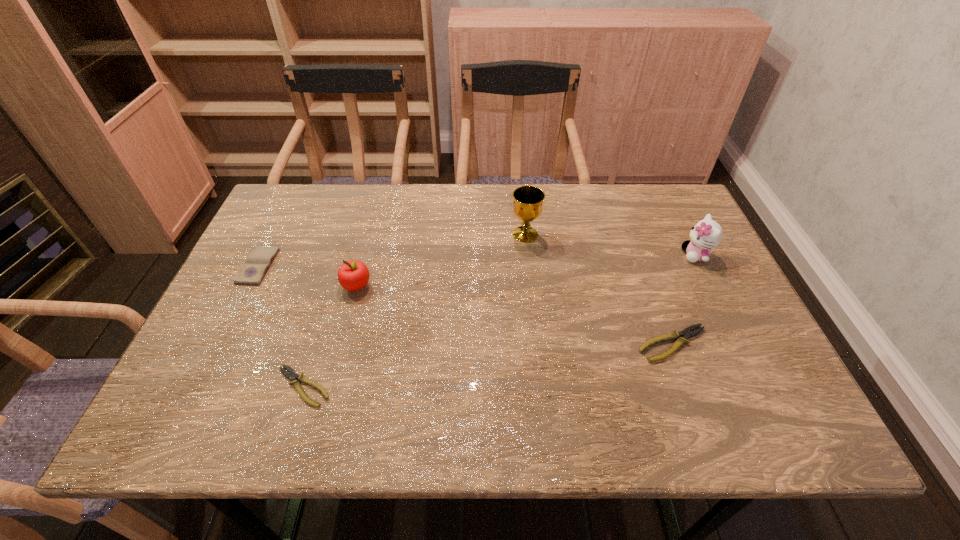
Locate which object is the fifth closest to the nearer pliers. Please provide its 2D coordinates. Your answer should be formatted as a tuple, i.e. [(x, y)], where the tuple contains the x and y coordinates of a point satisfying the conditions above.

[(706, 234)]

Locate an element on the screen. object that is the fourth closest to the fifth farthest object is located at coordinates (291, 375).

Where is `vacant region that satisfies the following two spatial constraints: 1. on the back side of the apple; 2. on the right side of the shortest object`? Image resolution: width=960 pixels, height=540 pixels. vacant region that satisfies the following two spatial constraints: 1. on the back side of the apple; 2. on the right side of the shortest object is located at coordinates (335, 286).